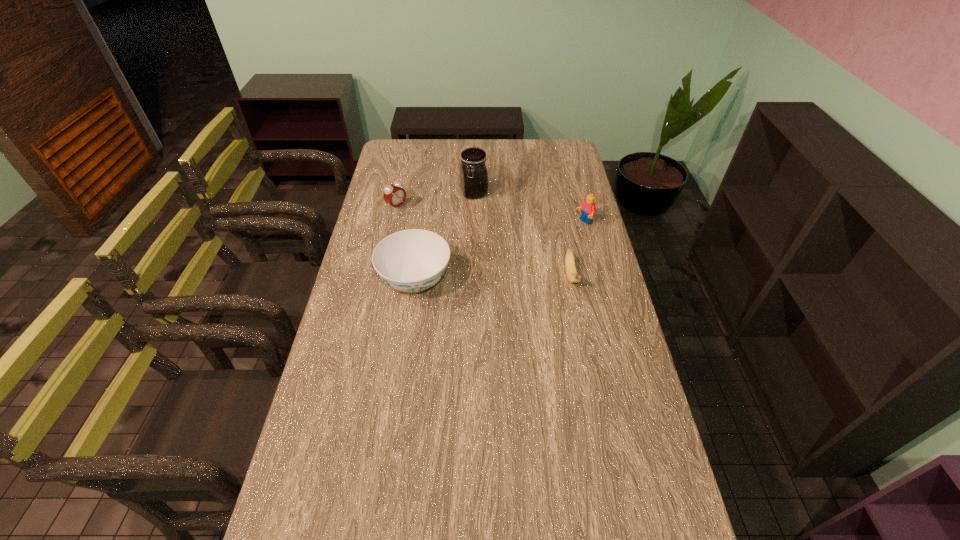
Where is `vacant space that is in between the alarm clock and the fourth object from left to right`? vacant space that is in between the alarm clock and the fourth object from left to right is located at coordinates (484, 241).

The width and height of the screenshot is (960, 540). What are the coordinates of `free space between the chinaware and the rightmost object` in the screenshot? It's located at (499, 252).

Where is `blank region between the alarm clock and the fourth object from left to right`? The width and height of the screenshot is (960, 540). blank region between the alarm clock and the fourth object from left to right is located at coordinates (484, 241).

What are the coordinates of `vacant region between the banana and the alarm clock` in the screenshot? It's located at [x=484, y=241].

Image resolution: width=960 pixels, height=540 pixels. Identify the location of vacant point located between the chinaware and the third farthest object. (499, 252).

Where is `vacant space that is in between the alarm clock and the rightmost object`? This screenshot has width=960, height=540. vacant space that is in between the alarm clock and the rightmost object is located at coordinates (491, 214).

Where is `free area in between the Lego and the chinaware`? The height and width of the screenshot is (540, 960). free area in between the Lego and the chinaware is located at coordinates (499, 252).

Select which object appears as the closest to the chinaware. Please provide its 2D coordinates. Your answer should be formatted as a tuple, i.e. [(x, y)], where the tuple contains the x and y coordinates of a point satisfying the conditions above.

[(393, 194)]

Identify the location of the closest object relative to the alarm clock. The height and width of the screenshot is (540, 960). (473, 172).

Locate an element on the screen. Image resolution: width=960 pixels, height=540 pixels. vacant space that satisfies the following two spatial constraints: 1. on the back side of the third nearest object; 2. on the right side of the chinaware is located at coordinates (423, 222).